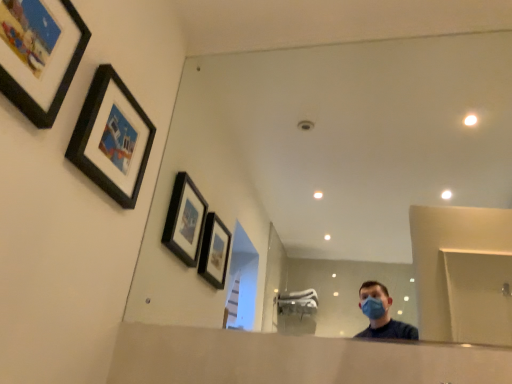
Question: From a real-world perspective, relative to matte black picture frame at upper left, arranged as the 2th picture frame when viewed from the back, is black matte picture frame at upper left, the first picture frame in the back-to-front sequence, vertically above or below?

Choices:
 (A) above
 (B) below

Answer: (B)

Question: In terms of size, does black matte picture frame at upper left, the first picture frame in the back-to-front sequence, appear bigger or smaller than matte black picture frame at upper left, arranged as the 2th picture frame when viewed from the back?

Choices:
 (A) big
 (B) small

Answer: (B)

Question: Which object is positioned closest to the matte black picture frame at upper left, arranged as the 1th picture frame when viewed from the front?

Choices:
 (A) black matte picture frame at upper left, which is the second picture frame in front-to-back order
 (B) clear glass mirror at center

Answer: (A)

Question: Based on their relative distances, which object is farther from the matte black picture frame at upper left, arranged as the 2th picture frame when viewed from the back?

Choices:
 (A) clear glass mirror at center
 (B) black matte picture frame at upper left, which is the second picture frame in front-to-back order

Answer: (A)